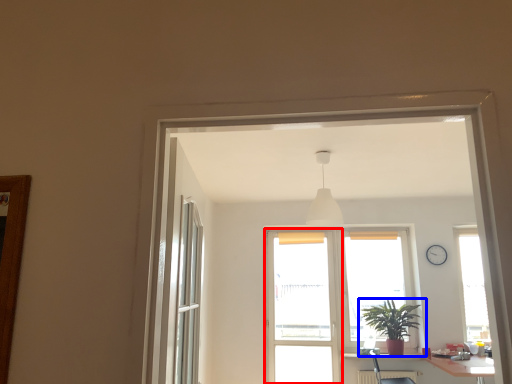
Question: Which of the following is the closest to the observer, screen door (highlighted by a red box) or houseplant (highlighted by a blue box)?

Choices:
 (A) screen door
 (B) houseplant

Answer: (B)